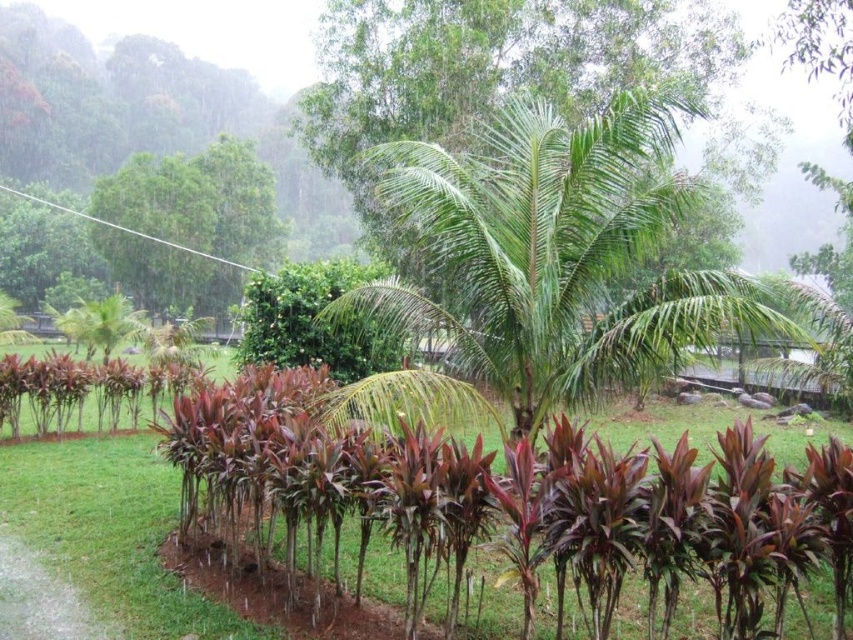
Is green leafy palm at center positioned behind purple-leaved plants at center?

No, it is in front of purple-leaved plants at center.

Between green leafy palm at center and purple-leaved plants at center, which one has more height?

With more height is green leafy palm at center.

Is point (672, 109) positioned before point (479, 552)?

No, (672, 109) is further to viewer.

You are a GUI agent. You are given a task and a screenshot of the screen. Output one action in this format:
    pyautogui.click(x=<x>, y=<y>)
    Task: Click on the green leafy palm at center
    
    Given the screenshot: What is the action you would take?
    pyautogui.click(x=544, y=268)